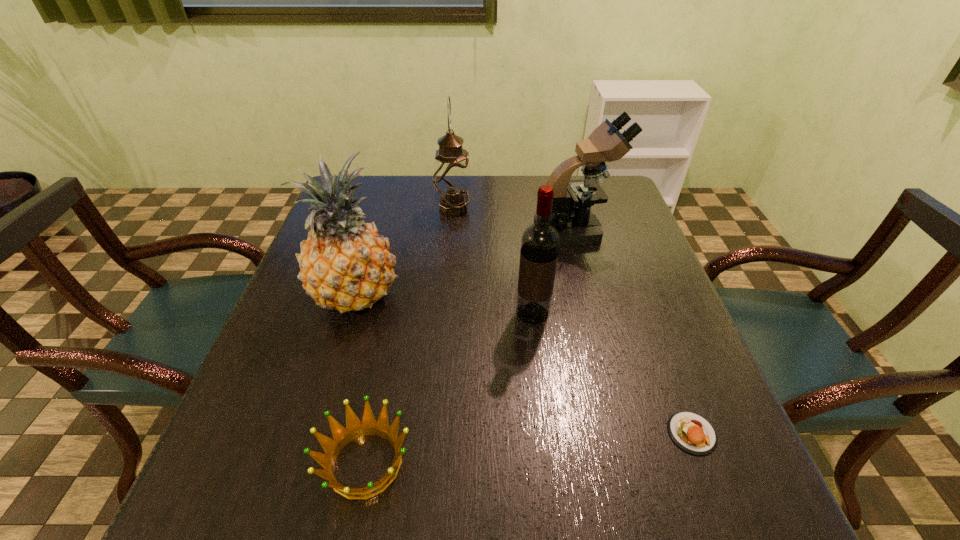
Find the location of `empty location between the microscope and the crown`. empty location between the microscope and the crown is located at coordinates (470, 347).

This screenshot has height=540, width=960. Find the location of `vacant space in between the crown and the wine bottle`. vacant space in between the crown and the wine bottle is located at coordinates (449, 388).

Locate an element on the screen. free spot between the pineapple and the shortest object is located at coordinates (524, 364).

Identify the location of unoccupied area between the wine bottle and the pineapple. (444, 304).

Find the location of `free space between the wine bottle and the fifth tallest object`. free space between the wine bottle and the fifth tallest object is located at coordinates (449, 388).

Locate which object ranks fifth in proximity to the oil lamp. Please provide its 2D coordinates. Your answer should be formatted as a tuple, i.e. [(x, y)], where the tuple contains the x and y coordinates of a point satisfying the conditions above.

[(691, 432)]

Identify which object is the fourth closest to the wine bottle. Please provide its 2D coordinates. Your answer should be formatted as a tuple, i.e. [(x, y)], where the tuple contains the x and y coordinates of a point satisfying the conditions above.

[(355, 428)]